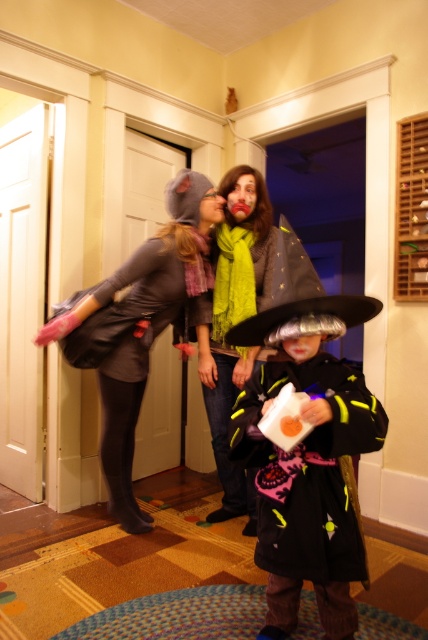
Question: Can you confirm if matte gray dress at left is positioned above shiny silver witch hat at center?

Choices:
 (A) yes
 (B) no

Answer: (A)

Question: Which point is farther to the camera?

Choices:
 (A) shiny silver witch hat at center
 (B) matte gray dress at left
 (C) matte black costume at center

Answer: (A)

Question: Which of the following is the farthest from the observer?

Choices:
 (A) shiny silver witch hat at center
 (B) matte gray dress at left
 (C) matte black costume at center

Answer: (A)

Question: Can you confirm if matte black costume at center is bigger than shiny silver witch hat at center?

Choices:
 (A) no
 (B) yes

Answer: (A)

Question: Which point is farther to the camera?

Choices:
 (A) (223, 348)
 (B) (285, 554)

Answer: (A)

Question: Is matte black costume at center closer to camera compared to shiny silver witch hat at center?

Choices:
 (A) no
 (B) yes

Answer: (B)